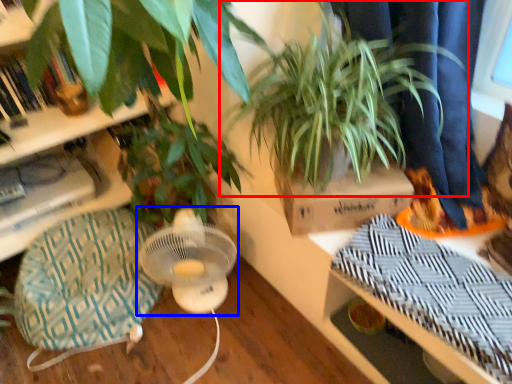
Question: Which object appears closest to the camera in this image, houseplant (highlighted by a red box) or mechanical fan (highlighted by a blue box)?

Choices:
 (A) houseplant
 (B) mechanical fan

Answer: (A)